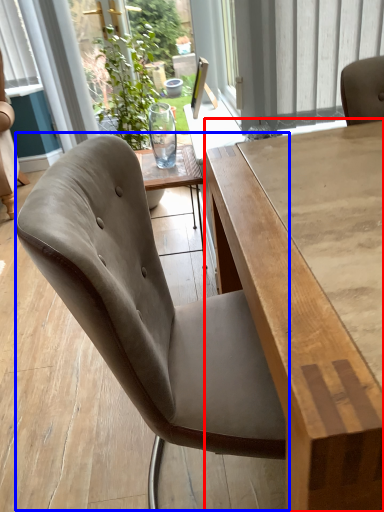
Question: Which point is closer to the camera, table (highlighted by a red box) or chair (highlighted by a blue box)?

Choices:
 (A) table
 (B) chair

Answer: (A)